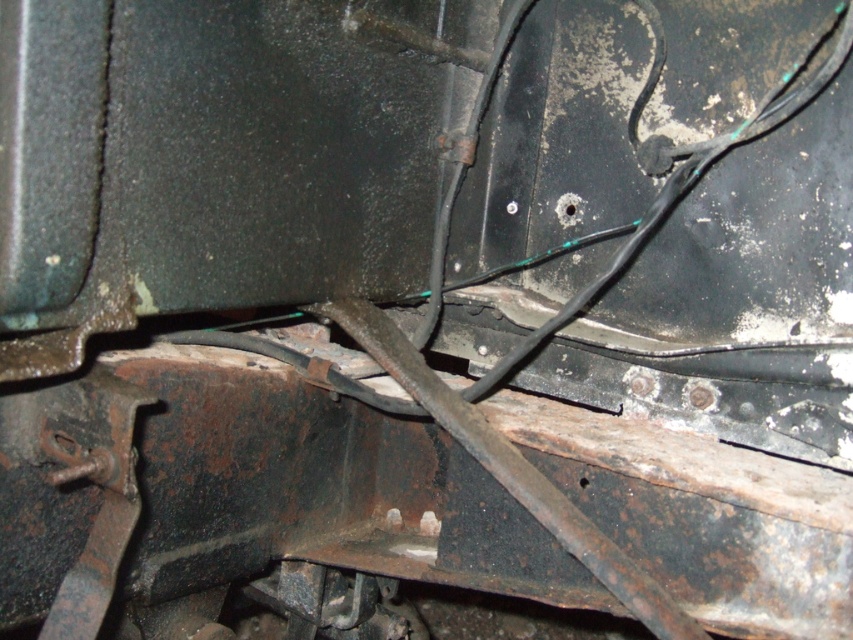
Consider the image. Can you confirm if silver metallic bolt at center is taller than black metal bolt at center?

Yes, silver metallic bolt at center is taller than black metal bolt at center.

Can you confirm if silver metallic bolt at center is shorter than black metal bolt at center?

No.

Between point (512, 202) and point (572, 205), which one is positioned behind?

Positioned behind is point (512, 202).

Locate an element on the screen. silver metallic bolt at center is located at coordinates (511, 208).